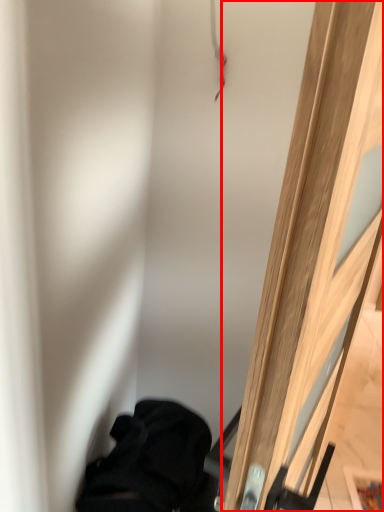
Question: From the image's perspective, where is door (annotated by the red box) located in relation to furniture in the image?

Choices:
 (A) below
 (B) above

Answer: (B)